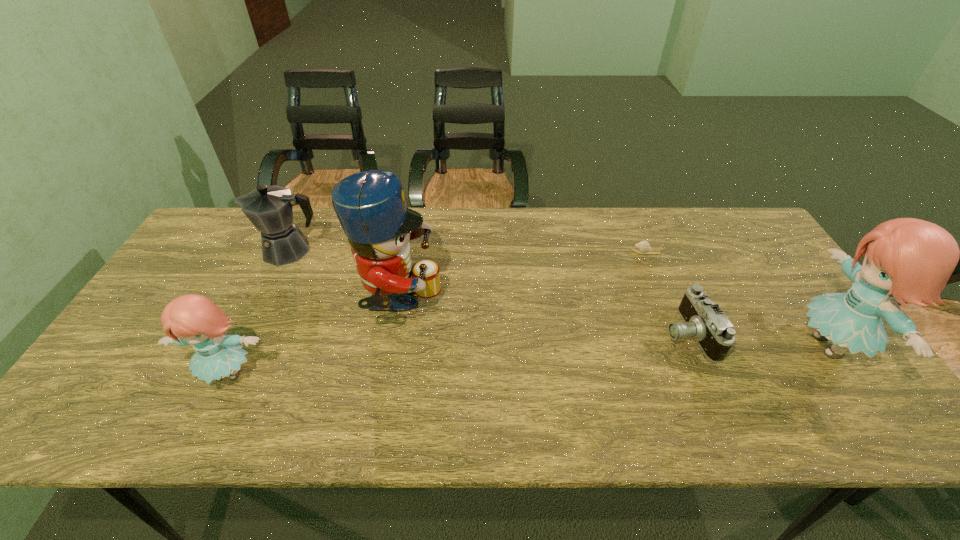
The width and height of the screenshot is (960, 540). In order to click on vacant space that satisfies the following two spatial constraints: 1. on the front-facing side of the rightmost object; 2. on the front-facing side of the left doll in this screenshot , I will do `click(849, 374)`.

The width and height of the screenshot is (960, 540). Find the location of `free location that satisfies the following two spatial constraints: 1. on the front-facing side of the nutcracker; 2. on the front-facing side of the shorter doll`. free location that satisfies the following two spatial constraints: 1. on the front-facing side of the nutcracker; 2. on the front-facing side of the shorter doll is located at coordinates (387, 374).